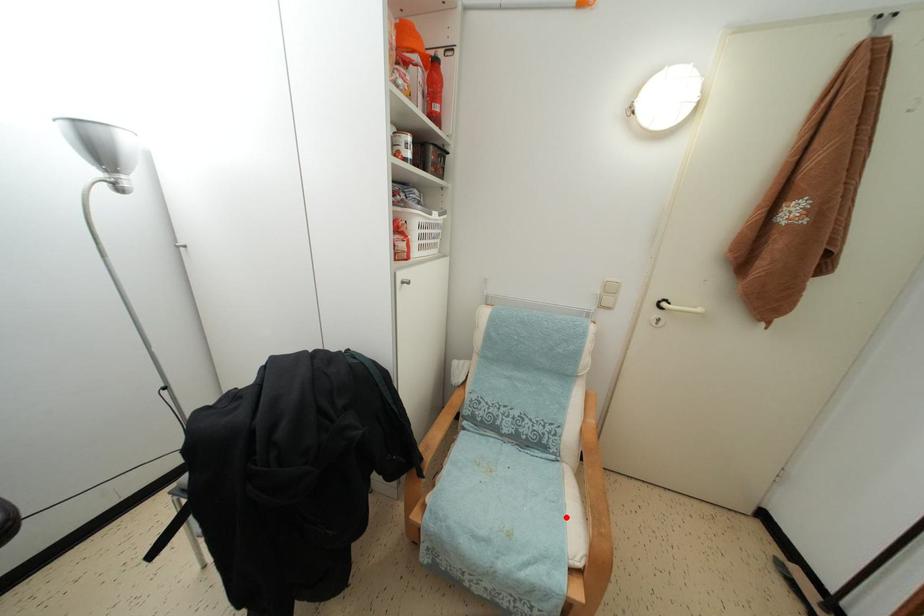
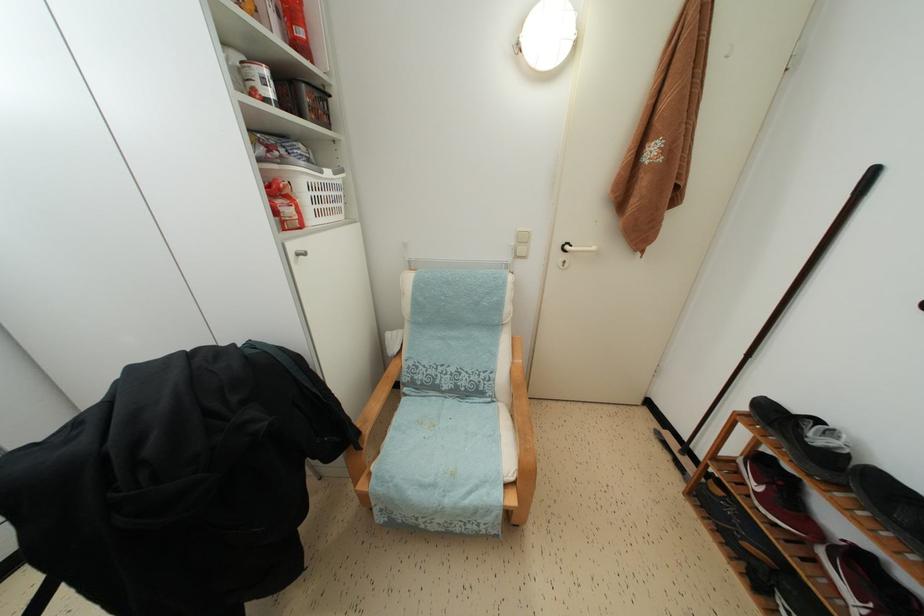
The point at the highlighted location is marked in the first image. Where is the corresponding point in the second image?

(502, 447)